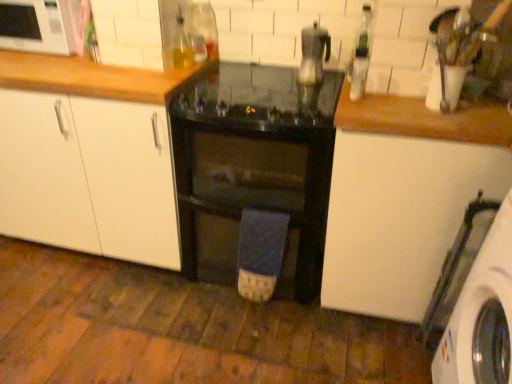
Where is `vacant area that is in front of white glossy microwave at upper left`? The height and width of the screenshot is (384, 512). vacant area that is in front of white glossy microwave at upper left is located at coordinates (42, 62).